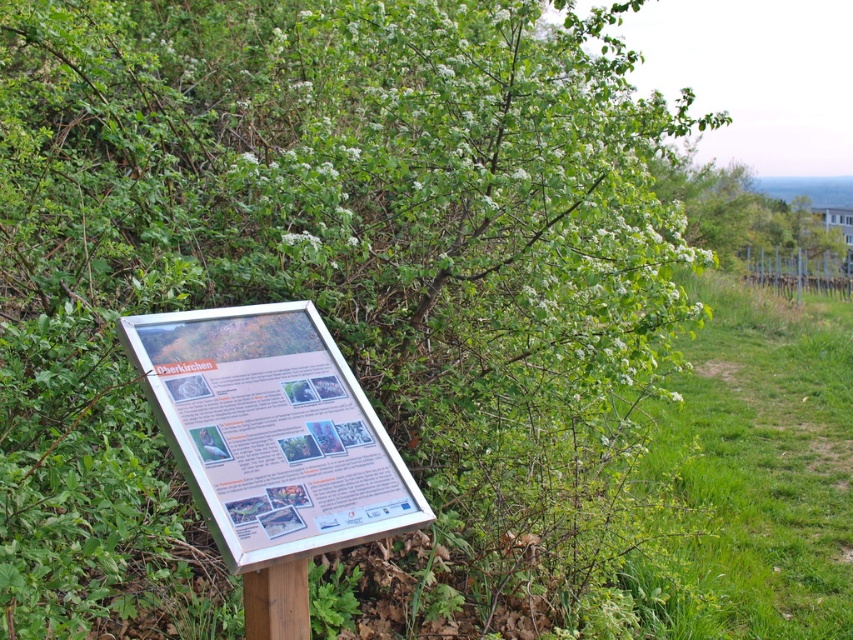
Can you confirm if white paper sign at center is wider than brown wooden pole at lower center?

Yes, white paper sign at center is wider than brown wooden pole at lower center.

Is point (276, 474) in front of point (257, 612)?

Yes, it is.

Measure the distance between point (180, 420) and camera.

Point (180, 420) and camera are 6.95 feet apart from each other.

This screenshot has height=640, width=853. I want to click on white paper sign at center, so click(x=271, y=432).